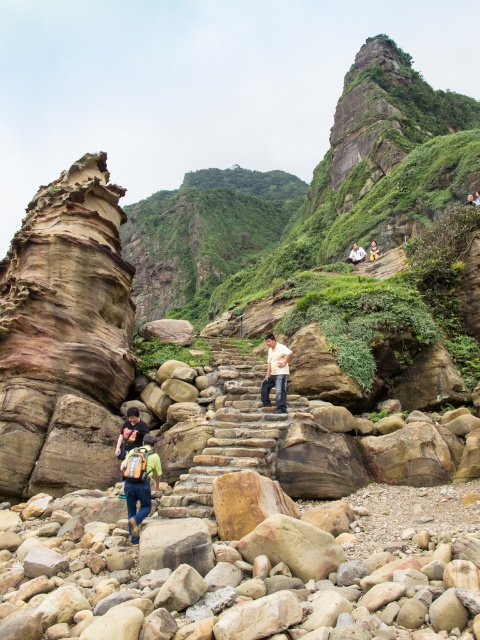
You are a hiker who has just reached the top of the stone staircase. You notice a green fabric backpack at lower left and a light brown leather jacket at center. Which item is taller?

The green fabric backpack at lower left is much taller than the light brown leather jacket at center.

You are hiking and need to decide which item to carry first. The green fabric backpack at lower left and the light brown leather jacket at center are both in your path. Which item is smaller and easier to pick up first?

The green fabric backpack at lower left is smaller in size compared to the light brown leather jacket at center, so it is easier to pick up first.

You are standing at the base of the stone staircase in the rugged landscape. You notice a point marked at coordinates (356, 253). Which object is located at that point?

The point at (356, 253) is on the light brown leather jacket at center.